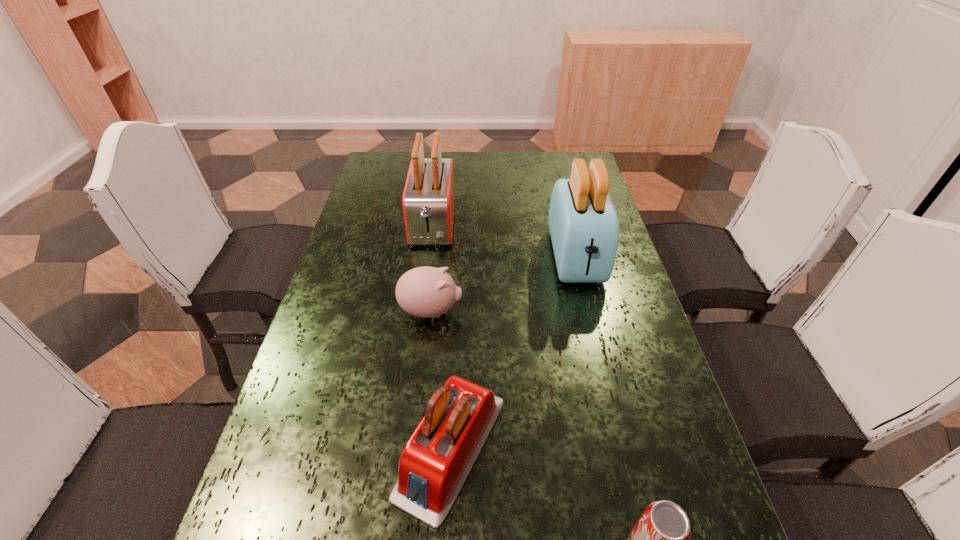
Locate an element on the screen. vacant area at the right edge of the desktop is located at coordinates (645, 410).

Find the location of `free point at the far left corner`. free point at the far left corner is located at coordinates (389, 179).

Identify the location of object that ranks as the closest to the piggy bank. click(x=436, y=461).

Identify the location of object identified as the second closest to the rightmost toaster. (428, 201).

This screenshot has width=960, height=540. I want to click on toaster that is the closest to the soda can, so click(436, 461).

Where is `the second closest toaster to the soda can`? This screenshot has width=960, height=540. the second closest toaster to the soda can is located at coordinates (583, 223).

This screenshot has height=540, width=960. What are the coordinates of `free space that satisfies the following two spatial constraints: 1. on the side of the rightmost toaster with the lever; 2. at the snout of the third nearest object` in the screenshot? It's located at (588, 311).

Where is `vacant point that satisfies the following two spatial constraints: 1. at the snout of the third nearest object; 2. on the left side of the nearest toaster`? The height and width of the screenshot is (540, 960). vacant point that satisfies the following two spatial constraints: 1. at the snout of the third nearest object; 2. on the left side of the nearest toaster is located at coordinates (416, 448).

Find the location of `vacant space that satisfies the following two spatial constraints: 1. on the side of the rightmost toaster with the lever; 2. at the snout of the piggy bank`. vacant space that satisfies the following two spatial constraints: 1. on the side of the rightmost toaster with the lever; 2. at the snout of the piggy bank is located at coordinates (588, 311).